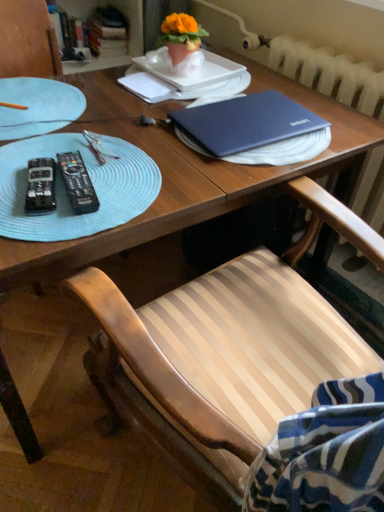
I want to click on vacant space in front of matte blue laptop at center, so click(216, 177).